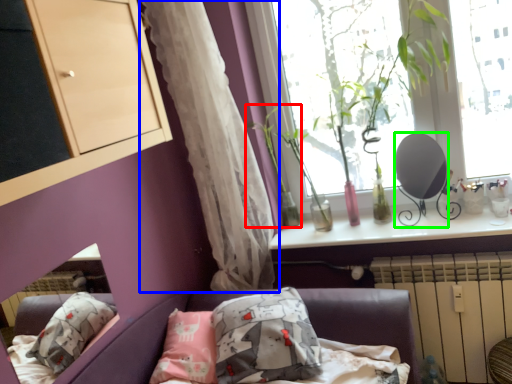
Question: Considering the real-world distances, which object is closest to plant (highlighted by a red box)? curtain (highlighted by a blue box) or mirror (highlighted by a green box).

Choices:
 (A) curtain
 (B) mirror

Answer: (A)